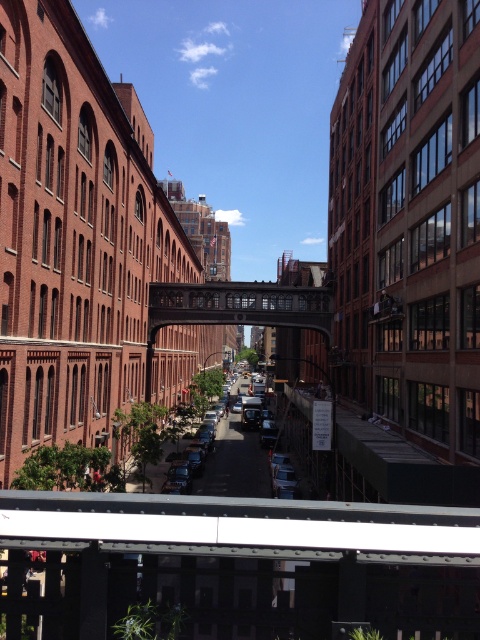
Between rustic metal bridge at center and shiny silver sedan at center, which one has less height?

shiny silver sedan at center

Looking at this image, who is higher up, rustic metal bridge at center or shiny silver sedan at center?

rustic metal bridge at center is higher up.

Which is in front, point (285, 304) or point (252, 436)?

Positioned in front is point (285, 304).

This screenshot has width=480, height=640. Find the location of `rustic metal bridge at center`. rustic metal bridge at center is located at coordinates (239, 305).